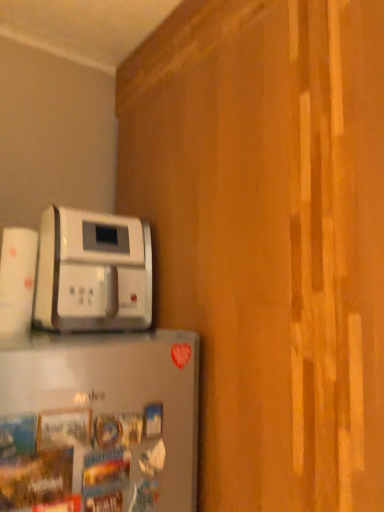
The image size is (384, 512). What are the coordinates of `white plastic coffee maker at upper left, marked as the second home appliance in a bottom-to-top arrangement` in the screenshot? It's located at (93, 272).

Describe the element at coordinates (93, 272) in the screenshot. I see `white plastic coffee maker at upper left, the 2th home appliance positioned from the front` at that location.

What do you see at coordinates (100, 422) in the screenshot? The width and height of the screenshot is (384, 512). I see `satin silver refrigerator at lower left, which appears as the 1th home appliance when ordered from the bottom` at bounding box center [100, 422].

Image resolution: width=384 pixels, height=512 pixels. In order to click on satin silver refrigerator at lower left, which appears as the 1th home appliance when ordered from the bottom in this screenshot , I will do `click(100, 422)`.

Locate an element on the screen. The height and width of the screenshot is (512, 384). white plastic coffee maker at upper left, the 2th home appliance positioned from the front is located at coordinates (93, 272).

Considering the positions of objects satin silver refrigerator at lower left, which appears as the 1th home appliance when viewed from the front, and white plastic coffee maker at upper left, which is the 1th home appliance from top to bottom, in the image provided, who is more to the left, satin silver refrigerator at lower left, which appears as the 1th home appliance when viewed from the front, or white plastic coffee maker at upper left, which is the 1th home appliance from top to bottom,?

Positioned to the left is white plastic coffee maker at upper left, which is the 1th home appliance from top to bottom.

Which is in front, satin silver refrigerator at lower left, which appears as the 1th home appliance when viewed from the front, or white plastic coffee maker at upper left, the 2th home appliance positioned from the front?

satin silver refrigerator at lower left, which appears as the 1th home appliance when viewed from the front.

Is point (147, 406) positioned after point (73, 210)?

No, (147, 406) is in front of (73, 210).

From the image's perspective, which object appears higher, satin silver refrigerator at lower left, which appears as the 1th home appliance when viewed from the front, or white plastic coffee maker at upper left, the 2th home appliance positioned from the front?

white plastic coffee maker at upper left, the 2th home appliance positioned from the front.

From a real-world perspective, between satin silver refrigerator at lower left, which appears as the 1th home appliance when viewed from the front, and white plastic coffee maker at upper left, which ranks as the first home appliance in back-to-front order, who is vertically lower?

satin silver refrigerator at lower left, which appears as the 1th home appliance when viewed from the front, from a real-world perspective.

Is satin silver refrigerator at lower left, which appears as the 1th home appliance when ordered from the bottom, thinner than white plastic coffee maker at upper left, the 2th home appliance positioned from the front?

Correct, the width of satin silver refrigerator at lower left, which appears as the 1th home appliance when ordered from the bottom, is less than that of white plastic coffee maker at upper left, the 2th home appliance positioned from the front.

Is satin silver refrigerator at lower left, which appears as the 1th home appliance when viewed from the front, taller than white plastic coffee maker at upper left, which is the 1th home appliance from top to bottom?

Indeed, satin silver refrigerator at lower left, which appears as the 1th home appliance when viewed from the front, has a greater height compared to white plastic coffee maker at upper left, which is the 1th home appliance from top to bottom.

Considering the relative sizes of satin silver refrigerator at lower left, the second home appliance from the top, and white plastic coffee maker at upper left, the 2th home appliance positioned from the front, in the image provided, is satin silver refrigerator at lower left, the second home appliance from the top, smaller than white plastic coffee maker at upper left, the 2th home appliance positioned from the front,?

Yes.

Could white plastic coffee maker at upper left, which ranks as the first home appliance in back-to-front order, be considered to be inside satin silver refrigerator at lower left, arranged as the 2th home appliance when viewed from the back?

No, white plastic coffee maker at upper left, which ranks as the first home appliance in back-to-front order, is not a part of satin silver refrigerator at lower left, arranged as the 2th home appliance when viewed from the back.

Is satin silver refrigerator at lower left, the second home appliance from the top, not near white plastic coffee maker at upper left, which is the 1th home appliance from top to bottom?

No.

Is satin silver refrigerator at lower left, which appears as the 1th home appliance when ordered from the bottom, looking in the opposite direction of white plastic coffee maker at upper left, which ranks as the first home appliance in back-to-front order?

No, satin silver refrigerator at lower left, which appears as the 1th home appliance when ordered from the bottom, is not facing the opposite direction of white plastic coffee maker at upper left, which ranks as the first home appliance in back-to-front order.

Identify the location of home appliance directly beneath the white plastic coffee maker at upper left, which ranks as the first home appliance in back-to-front order (from a real-world perspective). Image resolution: width=384 pixels, height=512 pixels. (100, 422).

Considering the relative positions of white plastic coffee maker at upper left, marked as the second home appliance in a bottom-to-top arrangement, and satin silver refrigerator at lower left, which appears as the 1th home appliance when viewed from the front, in the image provided, is white plastic coffee maker at upper left, marked as the second home appliance in a bottom-to-top arrangement, to the left of satin silver refrigerator at lower left, which appears as the 1th home appliance when viewed from the front, from the viewer's perspective?

Correct, you'll find white plastic coffee maker at upper left, marked as the second home appliance in a bottom-to-top arrangement, to the left of satin silver refrigerator at lower left, which appears as the 1th home appliance when viewed from the front.

In the image, is white plastic coffee maker at upper left, which ranks as the first home appliance in back-to-front order, positioned in front of or behind satin silver refrigerator at lower left, arranged as the 2th home appliance when viewed from the back?

white plastic coffee maker at upper left, which ranks as the first home appliance in back-to-front order, is behind satin silver refrigerator at lower left, arranged as the 2th home appliance when viewed from the back.

Is point (106, 304) positioned behind point (156, 444)?

Yes, point (106, 304) is farther from viewer.

From the image's perspective, does white plastic coffee maker at upper left, which ranks as the first home appliance in back-to-front order, appear higher than satin silver refrigerator at lower left, which appears as the 1th home appliance when viewed from the front?

Yes, from the image's perspective, white plastic coffee maker at upper left, which ranks as the first home appliance in back-to-front order, is above satin silver refrigerator at lower left, which appears as the 1th home appliance when viewed from the front.

From a real-world perspective, is white plastic coffee maker at upper left, marked as the second home appliance in a bottom-to-top arrangement, under satin silver refrigerator at lower left, the second home appliance from the top?

No.

Is white plastic coffee maker at upper left, the 2th home appliance positioned from the front, wider or thinner than satin silver refrigerator at lower left, the second home appliance from the top?

In the image, white plastic coffee maker at upper left, the 2th home appliance positioned from the front, appears to be wider than satin silver refrigerator at lower left, the second home appliance from the top.

Considering the sizes of white plastic coffee maker at upper left, which is the 1th home appliance from top to bottom, and satin silver refrigerator at lower left, arranged as the 2th home appliance when viewed from the back, in the image, is white plastic coffee maker at upper left, which is the 1th home appliance from top to bottom, taller or shorter than satin silver refrigerator at lower left, arranged as the 2th home appliance when viewed from the back,?

Clearly, white plastic coffee maker at upper left, which is the 1th home appliance from top to bottom, is shorter compared to satin silver refrigerator at lower left, arranged as the 2th home appliance when viewed from the back.

Can you confirm if white plastic coffee maker at upper left, which ranks as the first home appliance in back-to-front order, is smaller than satin silver refrigerator at lower left, the second home appliance from the top?

Actually, white plastic coffee maker at upper left, which ranks as the first home appliance in back-to-front order, might be larger than satin silver refrigerator at lower left, the second home appliance from the top.

Is satin silver refrigerator at lower left, which appears as the 1th home appliance when viewed from the front, located within white plastic coffee maker at upper left, which ranks as the first home appliance in back-to-front order?

No, white plastic coffee maker at upper left, which ranks as the first home appliance in back-to-front order, does not contain satin silver refrigerator at lower left, which appears as the 1th home appliance when viewed from the front.

Is white plastic coffee maker at upper left, the 2th home appliance positioned from the front, positioned far away from satin silver refrigerator at lower left, the second home appliance from the top?

No, white plastic coffee maker at upper left, the 2th home appliance positioned from the front, is not far away from satin silver refrigerator at lower left, the second home appliance from the top.

Could you tell me if white plastic coffee maker at upper left, which ranks as the first home appliance in back-to-front order, is facing satin silver refrigerator at lower left, the second home appliance from the top?

No, white plastic coffee maker at upper left, which ranks as the first home appliance in back-to-front order, is not turned towards satin silver refrigerator at lower left, the second home appliance from the top.

Based on the photo, what's the angular difference between white plastic coffee maker at upper left, the 2th home appliance positioned from the front, and satin silver refrigerator at lower left, which appears as the 1th home appliance when ordered from the bottom,'s facing directions?

white plastic coffee maker at upper left, the 2th home appliance positioned from the front, and satin silver refrigerator at lower left, which appears as the 1th home appliance when ordered from the bottom, are facing 0.00277 degrees away from each other.

Identify the location of home appliance that is above the satin silver refrigerator at lower left, the second home appliance from the top (from a real-world perspective). The width and height of the screenshot is (384, 512). (93, 272).

Identify the location of home appliance that appears on the left of satin silver refrigerator at lower left, arranged as the 2th home appliance when viewed from the back. Image resolution: width=384 pixels, height=512 pixels. (93, 272).

Locate an element on the screen. home appliance below the white plastic coffee maker at upper left, the 2th home appliance positioned from the front (from the image's perspective) is located at coordinates (100, 422).